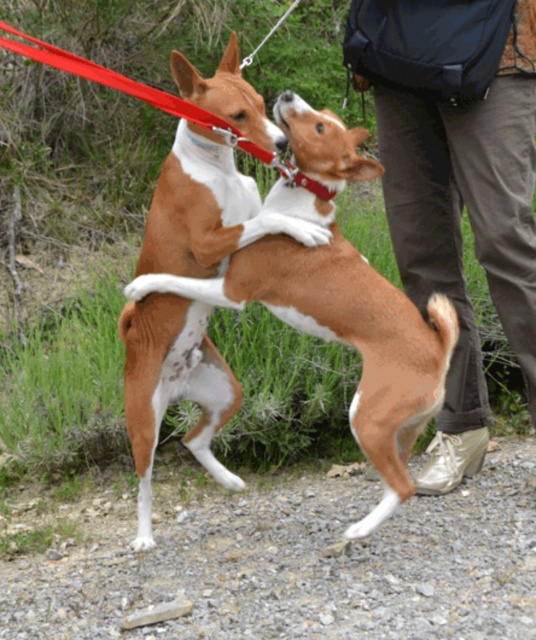
Question: Does brown suede pants at lower right appear on the right side of brown/white fur dog at center?

Choices:
 (A) no
 (B) yes

Answer: (B)

Question: Is brown suede pants at lower right bigger than brown/white fur dog at center?

Choices:
 (A) no
 (B) yes

Answer: (B)

Question: Is brown suede pants at lower right to the left of brown/white fur dog at center from the viewer's perspective?

Choices:
 (A) no
 (B) yes

Answer: (A)